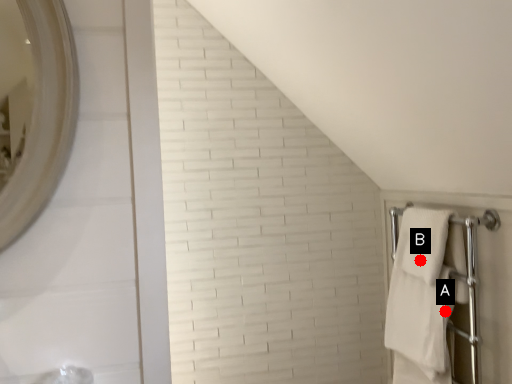
Question: Two points are circled on the image, labeled by A and B beside each circle. Which point is further to the camera?

Choices:
 (A) A is further
 (B) B is further

Answer: (B)